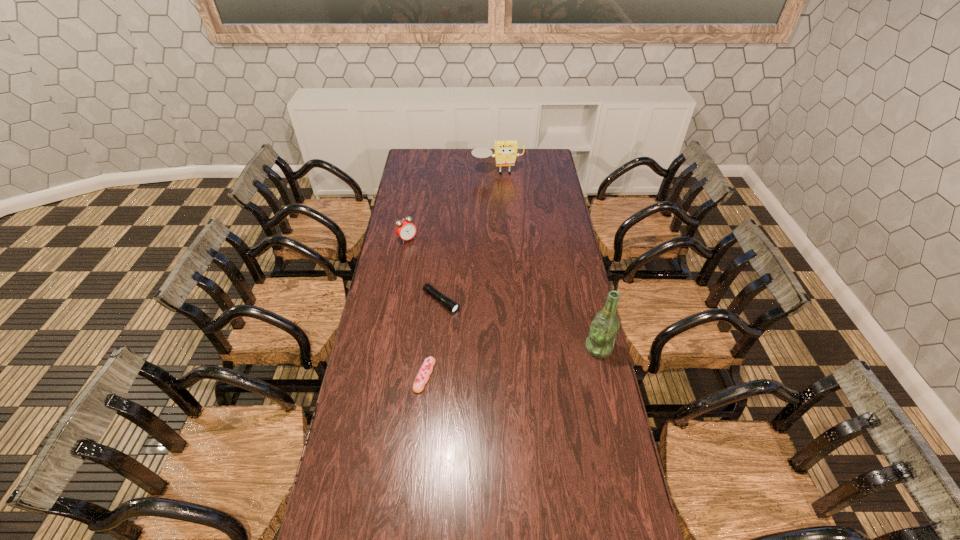
Locate an element on the screen. vacant space on the desktop that is between the eclair and the tallest object and is positioned at the lens end of the flashlight is located at coordinates (520, 360).

Locate an element on the screen. free space on the desktop that is between the eclair and the rightmost object and is positioned on the front-facing side of the third tallest object is located at coordinates (520, 360).

Where is `free space on the desktop that is between the eclair and the rightmost object and is positioned on the front-facing side of the fourth shortest object`? free space on the desktop that is between the eclair and the rightmost object and is positioned on the front-facing side of the fourth shortest object is located at coordinates (531, 359).